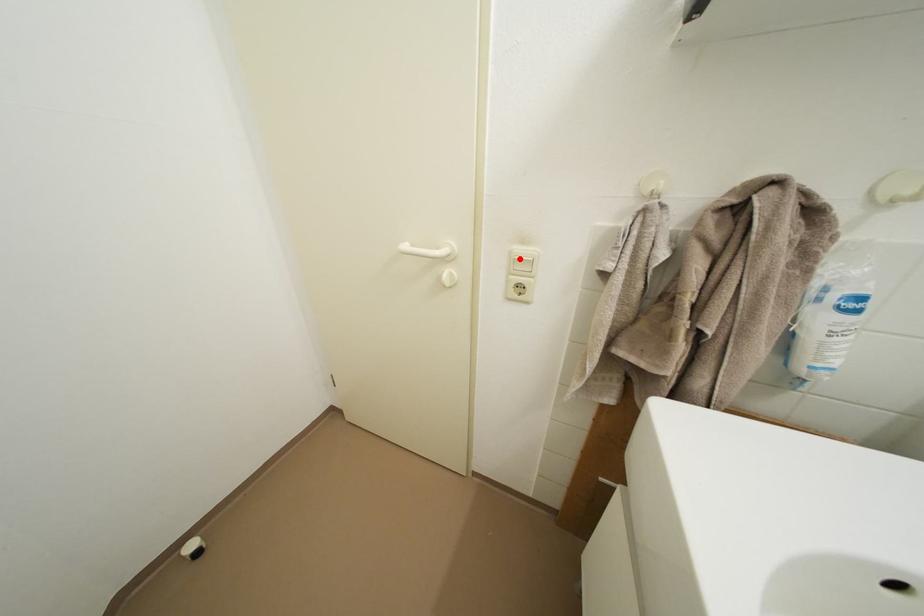
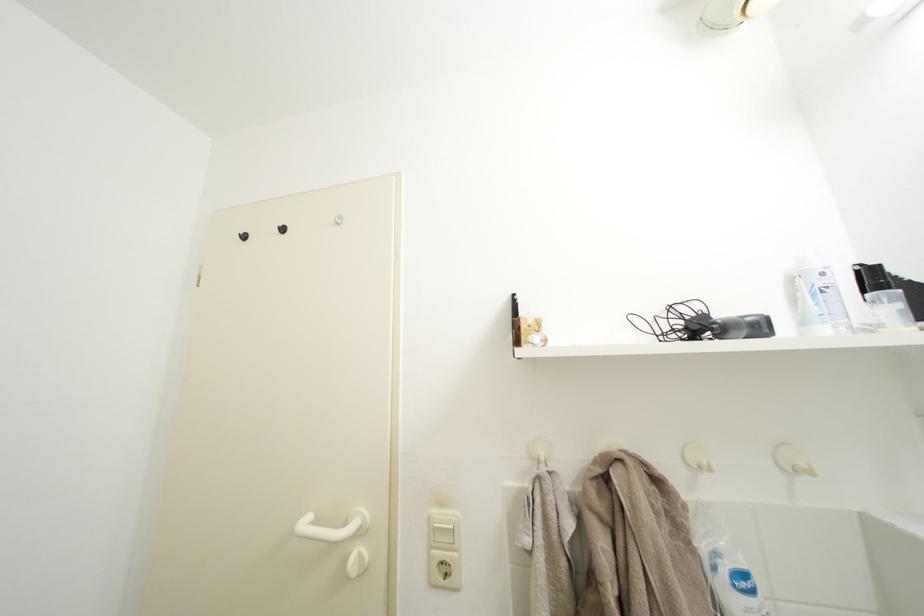
Locate, in the second image, the point that corresponds to the highlighted location in the first image.

(438, 525)